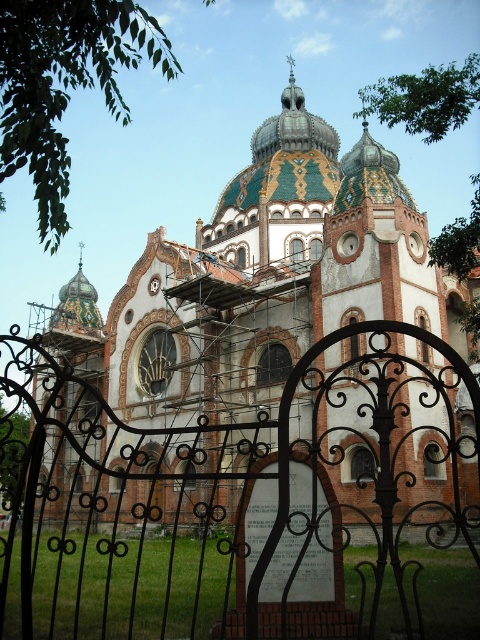
You are a delivery person trying to drive a truck that is 3 meters wide through the entrance of the building. The entrance is framed by the black wrought iron gate at center and the brick church at center. Can your truck fit through the entrance without any modifications?

The black wrought iron gate at center is wider than the brick church at center. Since the gate is wider, the entrance width is determined by the gate. The truck is 3 meters wide, and the gate is wider than the church. However, without specific measurements of the gate itself, we cannot confirm if it is wide enough for the truck. Please check the actual width of the gate.

You are standing in front of the building and want to enter through the entrance. Which object, the black wrought iron gate at center or the brick church at center, is larger in size?

The black wrought iron gate at center is bigger than the brick church at center, so the gate is larger in size.